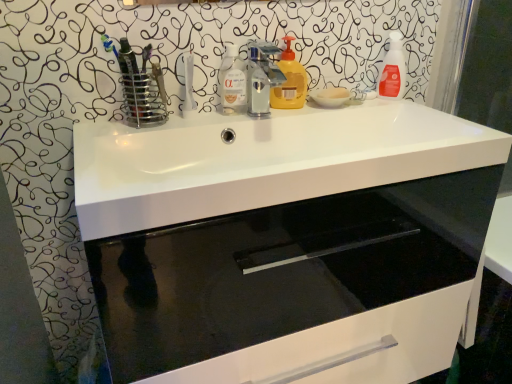
The width and height of the screenshot is (512, 384). In order to click on vacant area that lies between metallic silver faucet at center and yellow matte liquid soap at center, marked as the second cleaning product in a left-to-right arrangement in this screenshot , I will do `click(280, 112)`.